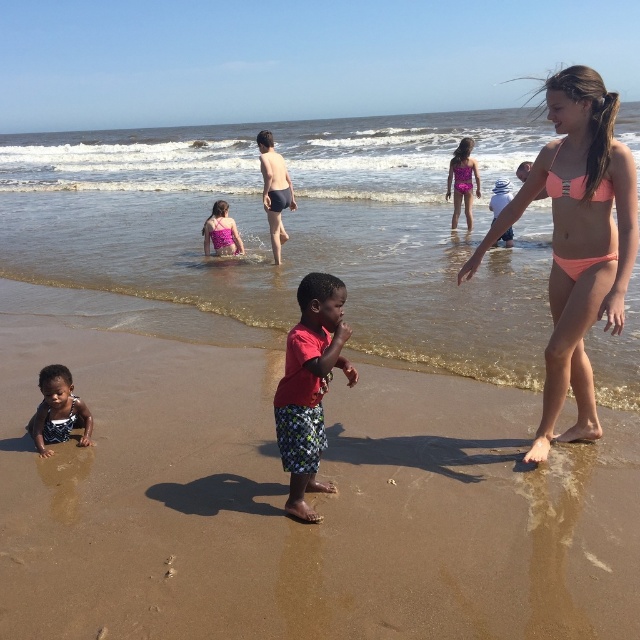
Is point (74, 476) farther from viewer compared to point (230, 225)?

No.

Identify the location of brown sandy beach at center. The image size is (640, 640). (284, 497).

Who is more distant from viewer, (362, 467) or (221, 237)?

Positioned behind is point (221, 237).

Identify the location of brown sandy beach at center. (284, 497).

How distant is brown sandy beach at center from purple shiny swimsuit at upper right?

brown sandy beach at center is 35.60 feet away from purple shiny swimsuit at upper right.

Identify the location of brown sandy beach at center. The height and width of the screenshot is (640, 640). (284, 497).

Locate an element on the screen. This screenshot has height=640, width=640. brown sandy beach at center is located at coordinates (284, 497).

Which of these two, brown sandy beach at center or white cotton hat at upper center, stands shorter?

With less height is brown sandy beach at center.

Is brown sandy beach at center positioned at the back of white cotton hat at upper center?

No, it is in front of white cotton hat at upper center.

Is point (355, 461) closer to camera compared to point (506, 204)?

Yes, point (355, 461) is in front of point (506, 204).

Locate an element on the screen. The image size is (640, 640). brown sandy beach at center is located at coordinates (284, 497).